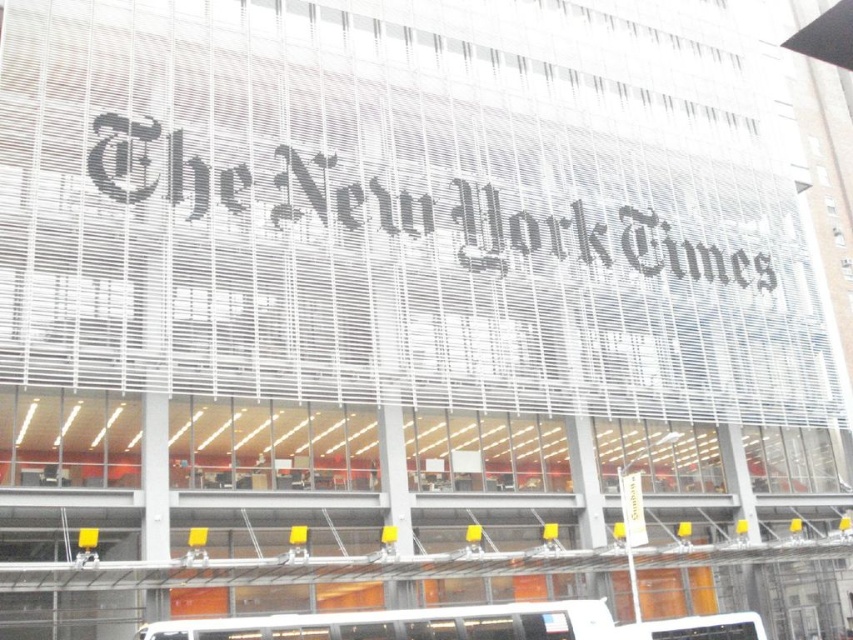
Question: Which point is closer to the camera?

Choices:
 (A) black paper at center
 (B) white matte tour bus at lower center

Answer: (B)

Question: Which object is farther from the camera taking this photo?

Choices:
 (A) white matte tour bus at lower center
 (B) black paper at center

Answer: (B)

Question: Can you confirm if black paper at center is positioned to the left of white matte tour bus at lower center?

Choices:
 (A) no
 (B) yes

Answer: (A)

Question: Does black paper at center appear under white matte tour bus at lower center?

Choices:
 (A) yes
 (B) no

Answer: (B)

Question: Considering the relative positions of black paper at center and white matte tour bus at lower center in the image provided, where is black paper at center located with respect to white matte tour bus at lower center?

Choices:
 (A) below
 (B) above

Answer: (B)

Question: Which object is closer to the camera taking this photo?

Choices:
 (A) white matte tour bus at lower center
 (B) black paper at center

Answer: (A)